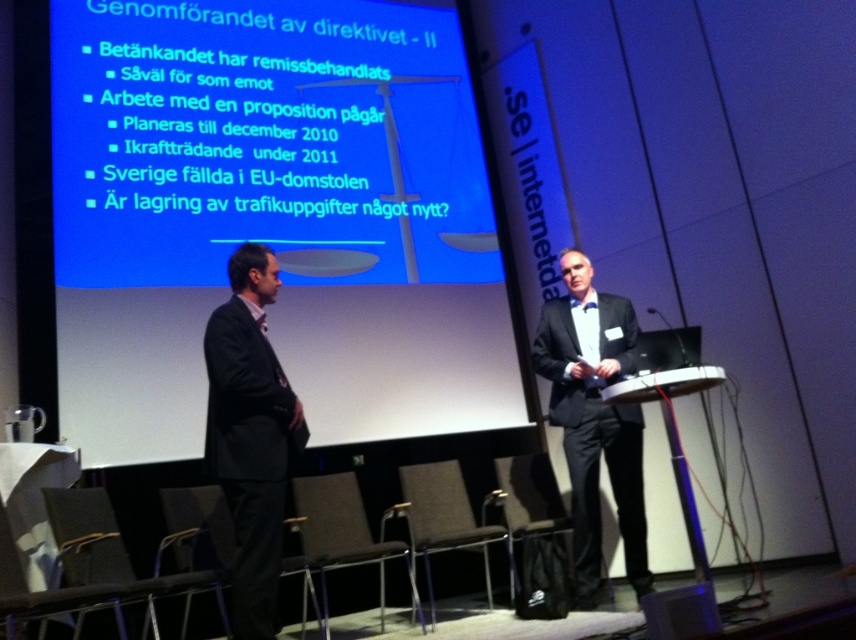
Is blue matte projection screen at upper center further to the viewer compared to black suit at center?

That is True.

In the scene shown: Is the position of blue matte projection screen at upper center less distant than that of black suit at center?

No, it is behind black suit at center.

Does point (403, 186) lie in front of point (643, 548)?

No, (403, 186) is further to viewer.

What are the coordinates of `blue matte projection screen at upper center` in the screenshot? It's located at [x=272, y=218].

Which is more to the left, black suit at left or blue plastic speaker at lower right?

Positioned to the left is black suit at left.

Locate an element on the screen. black suit at left is located at coordinates (250, 435).

At what (x,y) coordinates should I click in order to perform the action: click on black suit at left. Please return your answer as a coordinate pair (x, y). The height and width of the screenshot is (640, 856). Looking at the image, I should click on point(250,435).

Does blue matte projection screen at upper center come behind blue plastic speaker at lower right?

That is True.

At what (x,y) coordinates should I click in order to perform the action: click on blue matte projection screen at upper center. Please return your answer as a coordinate pair (x, y). This screenshot has height=640, width=856. Looking at the image, I should click on (272, 218).

This screenshot has height=640, width=856. What are the coordinates of `blue matte projection screen at upper center` in the screenshot? It's located at (272, 218).